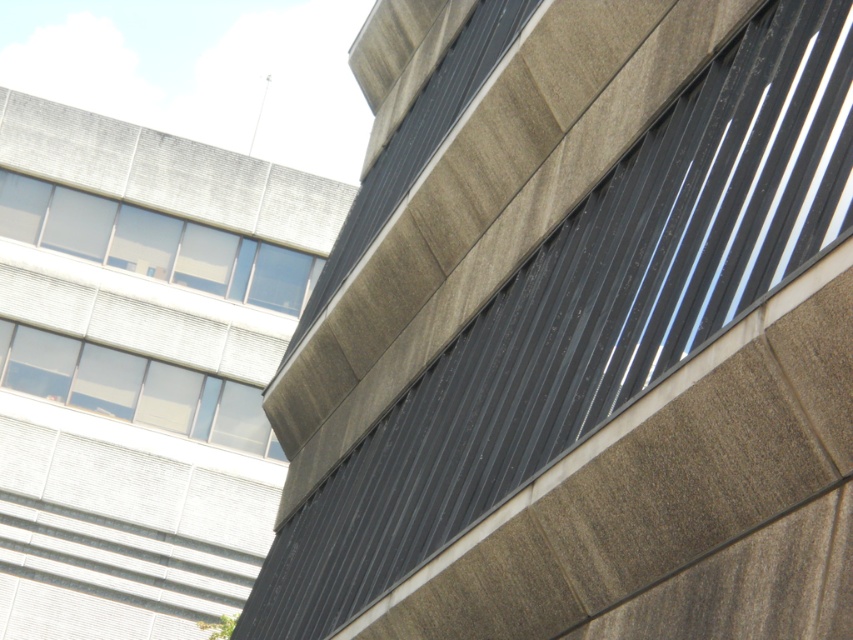
Is clear glass windows at upper left to the left of clear glass window at upper left from the viewer's perspective?

Incorrect, clear glass windows at upper left is not on the left side of clear glass window at upper left.

Who is more forward, (x=67, y=188) or (x=57, y=397)?

Point (x=57, y=397) is more forward.

This screenshot has width=853, height=640. Describe the element at coordinates (154, 243) in the screenshot. I see `clear glass windows at upper left` at that location.

Where is `clear glass windows at upper left`? clear glass windows at upper left is located at coordinates (154, 243).